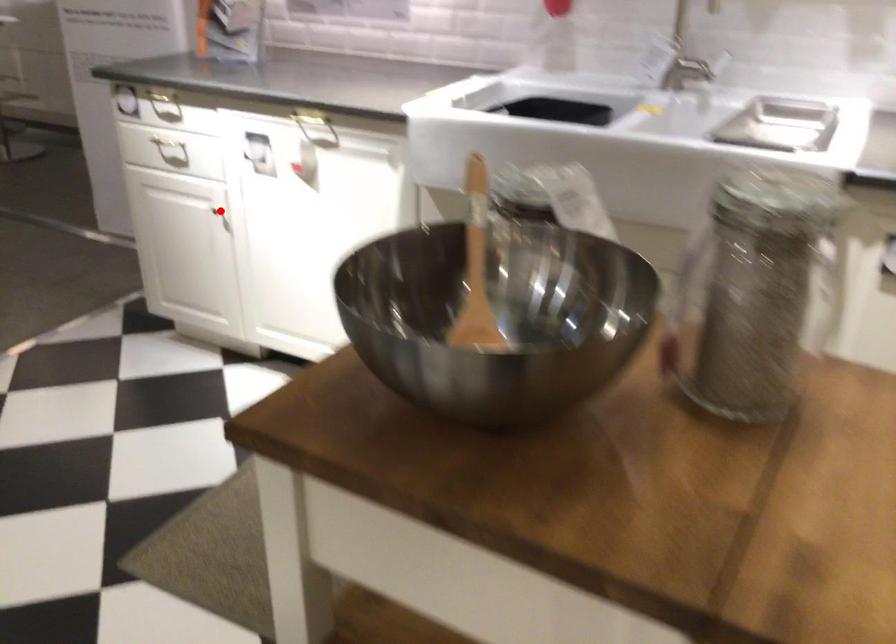
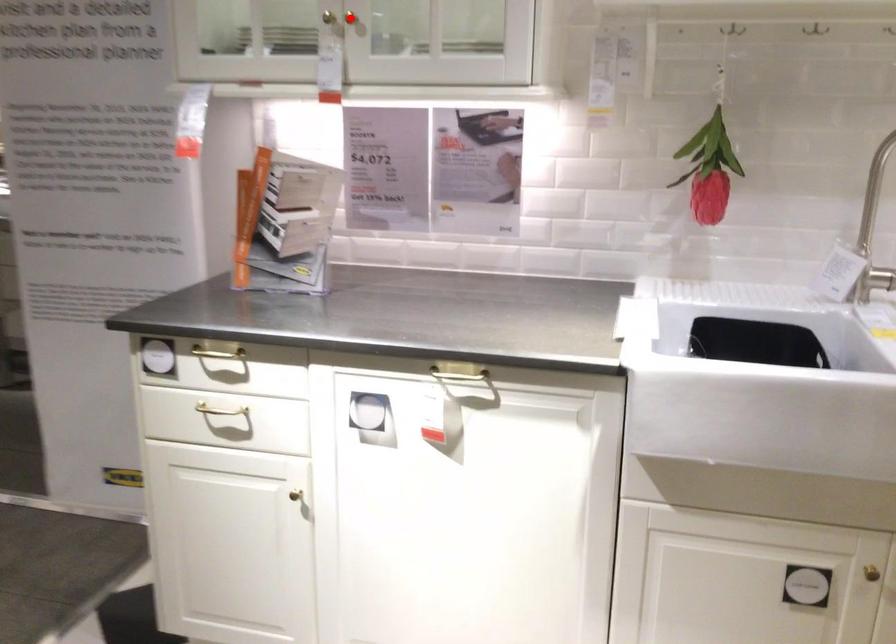
I am providing you with two images of the same scene from different viewpoints. A red point is marked on the first image and another point is marked on the second image. Are the points marked in image1 and image2 representing the same 3D position?

No